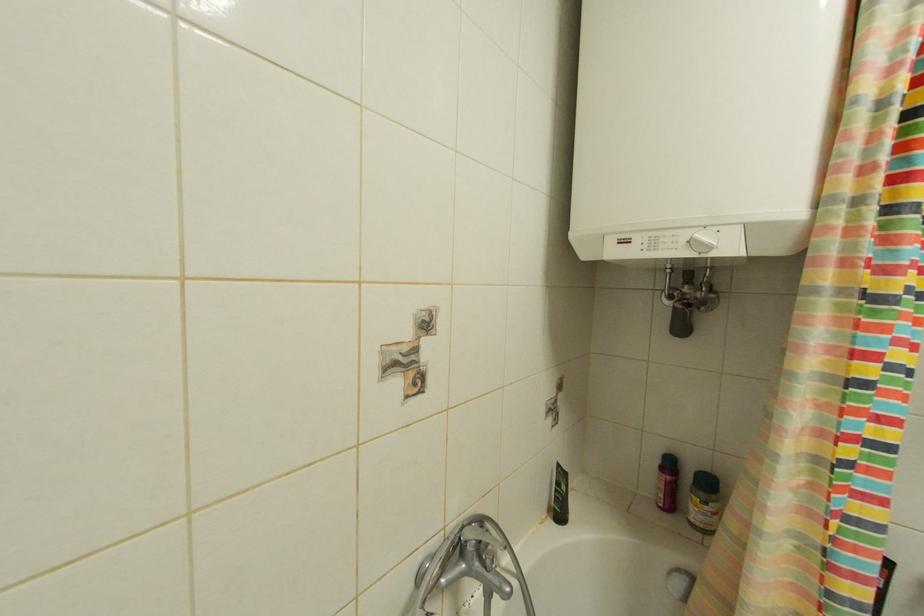
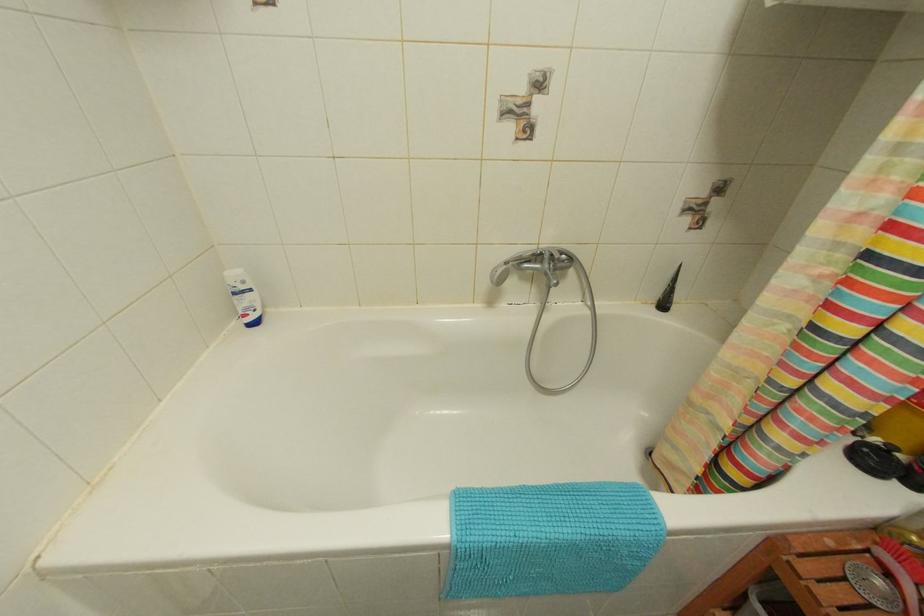
First-person continuous shooting, in which direction is the camera rotating?

The rotation direction of the camera is left-down.